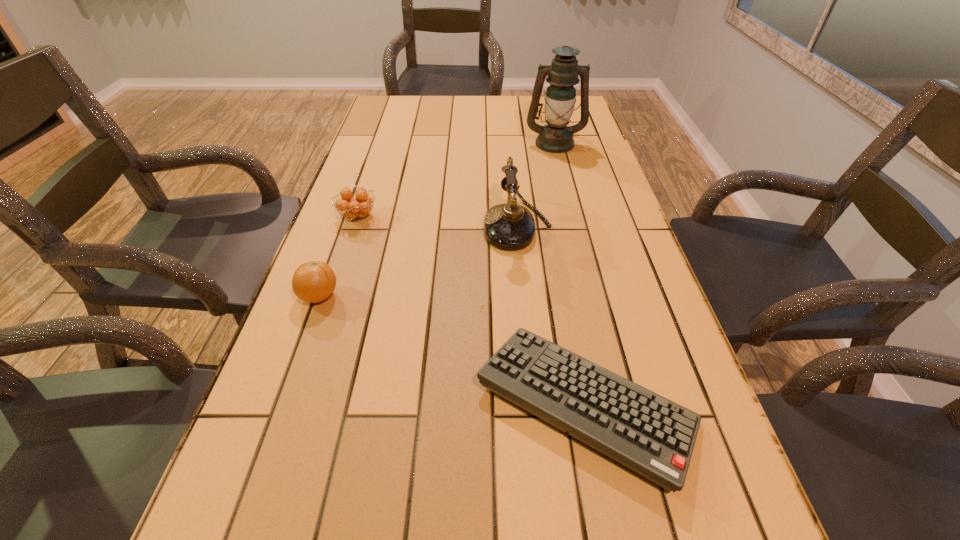
In order to click on free region located 0.110m on the dial of the fourth shortest object in this screenshot , I will do `click(442, 226)`.

This screenshot has height=540, width=960. I want to click on free space located 0.200m on the right of the nearer orange fruit, so click(431, 296).

I want to click on vacant area located on the right of the farther orange fruit, so click(412, 217).

The width and height of the screenshot is (960, 540). Identify the location of vacant space located on the back of the shortest object. (564, 296).

Where is `oil lamp that is at the right edge`? This screenshot has height=540, width=960. oil lamp that is at the right edge is located at coordinates pos(556,137).

Identify the location of computer keyboard present at the right edge. The width and height of the screenshot is (960, 540). (642, 430).

Locate an element on the screen. Image resolution: width=960 pixels, height=540 pixels. vacant space at the far edge of the desktop is located at coordinates (441, 113).

This screenshot has width=960, height=540. Find the location of `vacant space at the left edge of the desktop`. vacant space at the left edge of the desktop is located at coordinates (360, 166).

I want to click on free space at the right edge of the desktop, so click(618, 221).

Where is `free space at the far left corner`? free space at the far left corner is located at coordinates (409, 105).